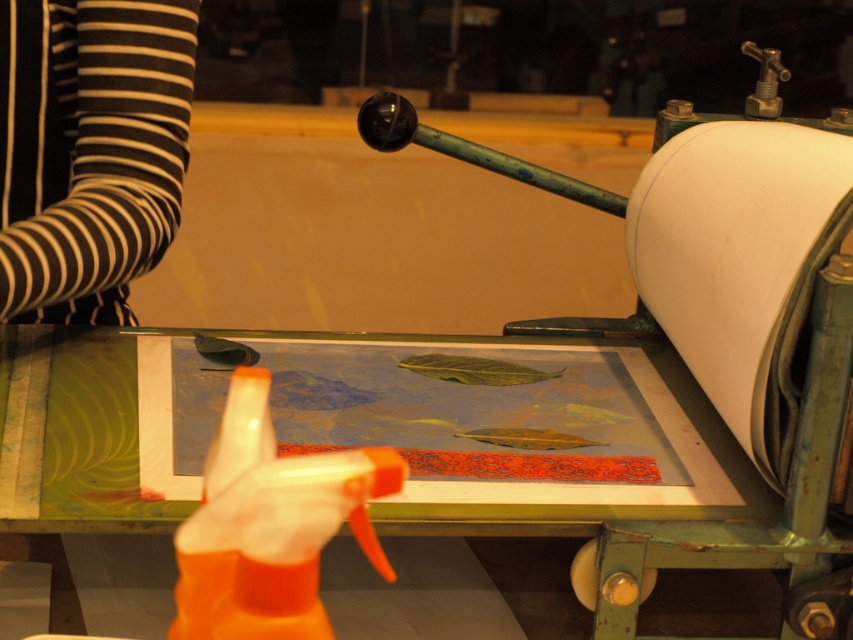
You are an artist working in the printmaking studio. You have a black striped fabric at upper left that you need to move to the center of your workspace. The workspace is 36 inches wide. Can you move the fabric to the center without it overlapping any other objects?

The black striped fabric at upper left is 29.45 inches away from the center of the workspace. Since the workspace is 36 inches wide, moving it 29.45 inches towards the center would leave enough space between it and other objects, so yes, you can move it without overlapping.

You are organizing a workspace and need to place a heavy item on the lowest shelf. Which object should you avoid placing there to keep it from being crushed by the weight? The black striped fabric at upper left or the white paper at right?

You should avoid placing the black striped fabric at upper left on the lowest shelf because it is located above the white paper at right, meaning it might be placed higher up and moving it could disrupt the setup.